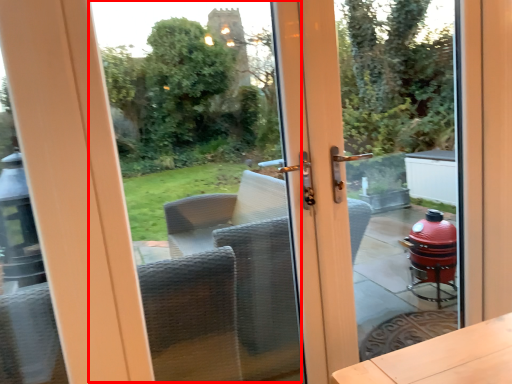
Question: From the image's perspective, where is window screen (annotated by the red box) located relative to glass door?

Choices:
 (A) below
 (B) above

Answer: (A)